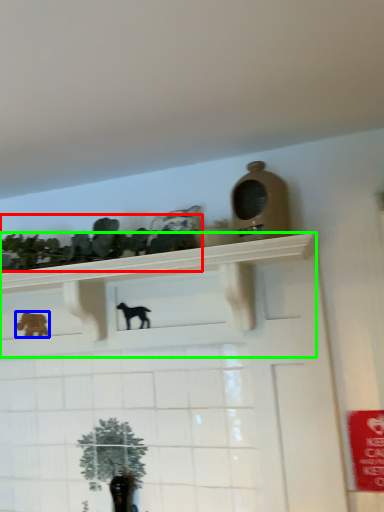
Question: Estimate the real-world distances between objects in this image. Which object is farther from collection (highlighted by a red box), animal (highlighted by a blue box) or shelf (highlighted by a green box)?

Choices:
 (A) animal
 (B) shelf

Answer: (A)